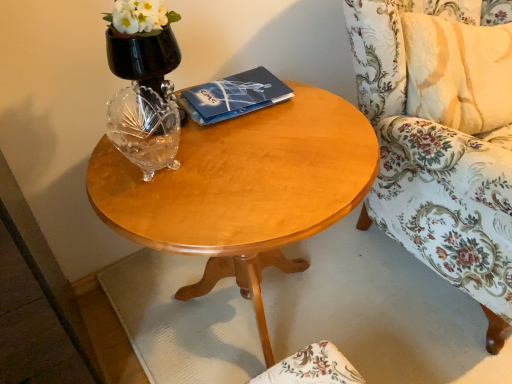
Question: Would you say black glass vase at upper left is outside floral fabric chair at right?

Choices:
 (A) yes
 (B) no

Answer: (A)

Question: Is black glass vase at upper left bigger than floral fabric chair at right?

Choices:
 (A) yes
 (B) no

Answer: (B)

Question: Does black glass vase at upper left lie in front of floral fabric chair at right?

Choices:
 (A) no
 (B) yes

Answer: (A)

Question: From a real-world perspective, is black glass vase at upper left on top of floral fabric chair at right?

Choices:
 (A) yes
 (B) no

Answer: (A)

Question: Is black glass vase at upper left positioned behind floral fabric chair at right?

Choices:
 (A) yes
 (B) no

Answer: (A)

Question: From the image's perspective, is floral fabric chair at right positioned above or below dark blue matte paper at center?

Choices:
 (A) below
 (B) above

Answer: (A)

Question: Looking at their shapes, would you say floral fabric chair at right is wider or thinner than dark blue matte paper at center?

Choices:
 (A) thin
 (B) wide

Answer: (B)

Question: From a real-world perspective, is floral fabric chair at right physically located above or below dark blue matte paper at center?

Choices:
 (A) below
 (B) above

Answer: (A)

Question: Is point (406, 226) positioned closer to the camera than point (198, 110)?

Choices:
 (A) farther
 (B) closer

Answer: (A)

Question: From a real-world perspective, is light wood/finish coffee table at center physically located above or below floral fabric chair at right?

Choices:
 (A) above
 (B) below

Answer: (B)

Question: From the image's perspective, is light wood/finish coffee table at center above or below floral fabric chair at right?

Choices:
 (A) above
 (B) below

Answer: (B)

Question: Is light wood/finish coffee table at center wider or thinner than floral fabric chair at right?

Choices:
 (A) thin
 (B) wide

Answer: (A)

Question: Considering the positions of light wood/finish coffee table at center and floral fabric chair at right in the image, is light wood/finish coffee table at center bigger or smaller than floral fabric chair at right?

Choices:
 (A) small
 (B) big

Answer: (A)

Question: Visually, is dark blue matte paper at center positioned to the left or to the right of black glass vase at upper left?

Choices:
 (A) left
 (B) right

Answer: (B)

Question: Relative to black glass vase at upper left, is dark blue matte paper at center in front or behind?

Choices:
 (A) front
 (B) behind

Answer: (B)